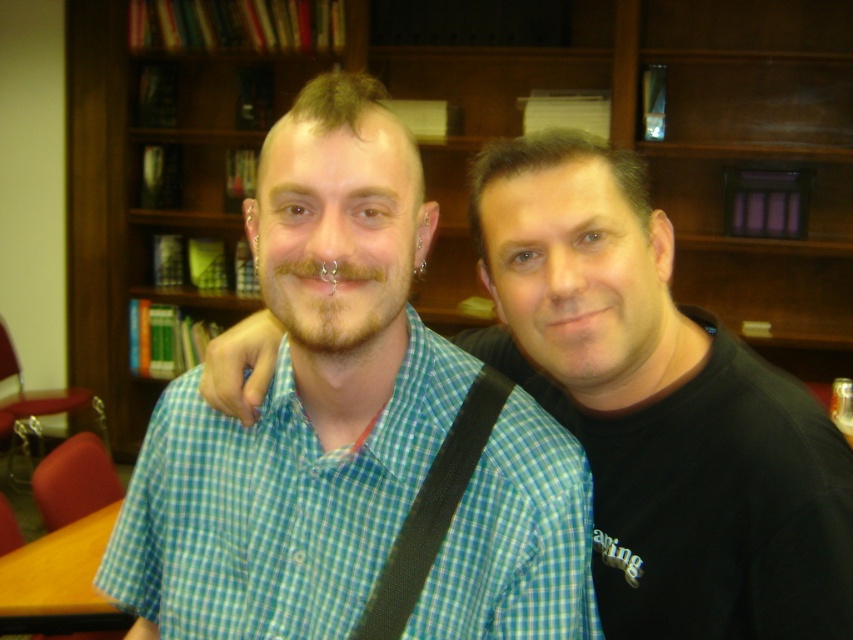
Is blue checkered shirt at center above green checkered shirt at center?

Correct, blue checkered shirt at center is located above green checkered shirt at center.

Is point (506, 147) less distant than point (579, 572)?

No, it is not.

This screenshot has height=640, width=853. I want to click on blue checkered shirt at center, so click(x=659, y=406).

The height and width of the screenshot is (640, 853). Describe the element at coordinates (335, 296) in the screenshot. I see `brownhairbeard at center` at that location.

Who is positioned more to the left, brownhairbeard at center or black fabric strap at center?

brownhairbeard at center

Between point (338, 300) and point (463, 416), which one is positioned in front?

Point (338, 300) is in front.

You are a GUI agent. You are given a task and a screenshot of the screen. Output one action in this format:
    pyautogui.click(x=<x>, y=<y>)
    Task: Click on the brownhairbeard at center
    
    Given the screenshot: What is the action you would take?
    pyautogui.click(x=335, y=296)

Locate an element on the screen. The width and height of the screenshot is (853, 640). blue checkered shirt at center is located at coordinates click(659, 406).

Between blue checkered shirt at center and brownhairbeard at center, which one is positioned lower?

blue checkered shirt at center is lower down.

Is point (537, 381) behind point (345, 291)?

That is True.

Locate an element on the screen. blue checkered shirt at center is located at coordinates (659, 406).